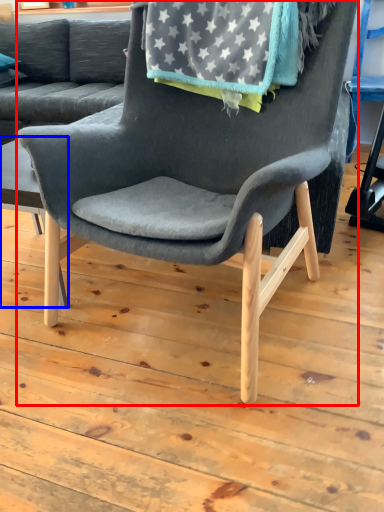
Question: Which of the following is the closest to the observer, chair (highlighted by a red box) or table (highlighted by a blue box)?

Choices:
 (A) chair
 (B) table

Answer: (A)